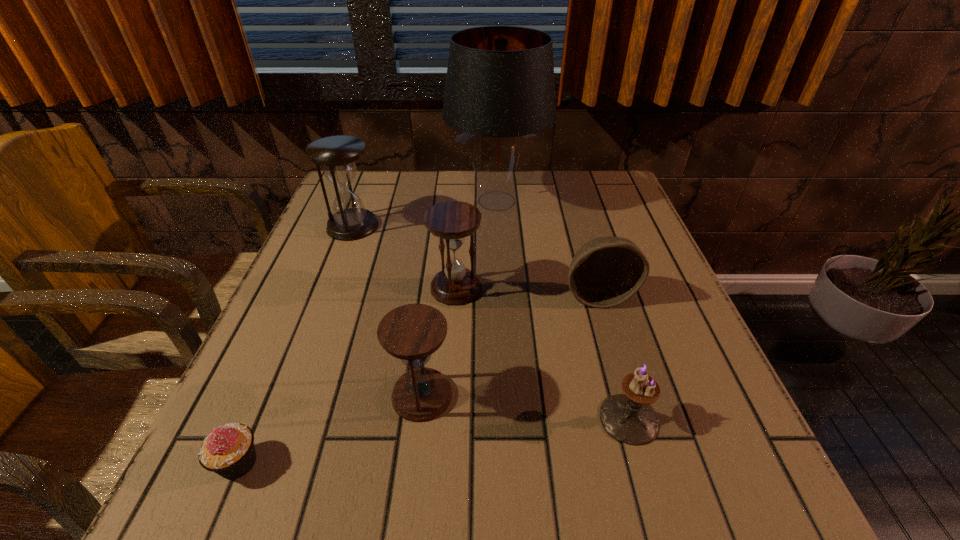
Locate an element on the screen. This screenshot has width=960, height=540. candle holder positioned at the right edge is located at coordinates (628, 418).

This screenshot has height=540, width=960. Find the location of `object that is at the far left corner`. object that is at the far left corner is located at coordinates (337, 155).

Locate an element on the screen. Image resolution: width=960 pixels, height=540 pixels. object present at the near left corner is located at coordinates (229, 451).

Image resolution: width=960 pixels, height=540 pixels. Identify the location of vacant space at the far edge of the desktop. (460, 199).

The width and height of the screenshot is (960, 540). What are the coordinates of `free region at the near edge` in the screenshot? It's located at (535, 470).

Locate an element on the screen. The image size is (960, 540). blank area at the left edge is located at coordinates (285, 305).

Find the location of `vacant region at the right edge`. vacant region at the right edge is located at coordinates (694, 346).

In the image, there is a desktop. Where is `vacant space at the far right corner`? The height and width of the screenshot is (540, 960). vacant space at the far right corner is located at coordinates (626, 186).

Identify the location of empty location between the bowl and the second farthest hourglass. (527, 292).

Where is `empty space that is in between the nearest hourglass and the farthest hourglass`? The width and height of the screenshot is (960, 540). empty space that is in between the nearest hourglass and the farthest hourglass is located at coordinates (387, 310).